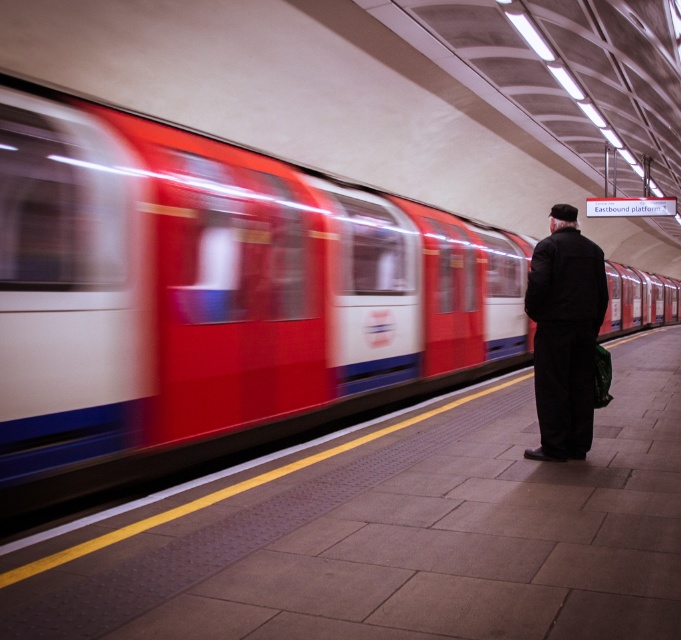
Question: Considering the relative positions of white glossy train at center and dark woolen coat at center in the image provided, where is white glossy train at center located with respect to dark woolen coat at center?

Choices:
 (A) right
 (B) left

Answer: (A)

Question: Which point is farther to the camera?

Choices:
 (A) white glossy train at center
 (B) dark woolen coat at center

Answer: (B)

Question: Among these points, which one is farthest from the camera?

Choices:
 (A) (202, 259)
 (B) (570, 282)

Answer: (B)

Question: Which point is farther to the camera?

Choices:
 (A) (5, 188)
 (B) (558, 266)

Answer: (B)

Question: Can you confirm if white glossy train at center is positioned above dark woolen coat at center?

Choices:
 (A) yes
 (B) no

Answer: (A)

Question: Can you confirm if white glossy train at center is thinner than dark woolen coat at center?

Choices:
 (A) yes
 (B) no

Answer: (B)